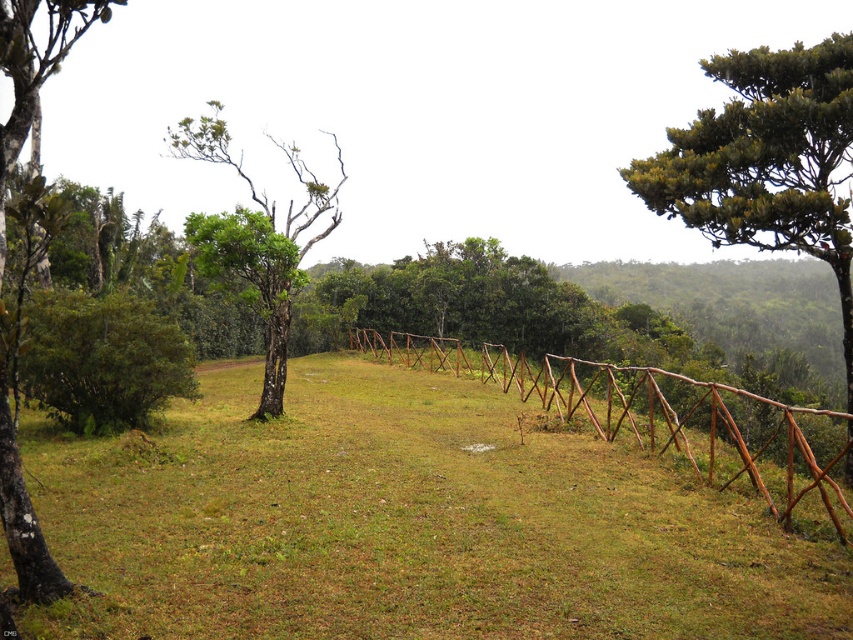
You are standing in the middle of the grassy area and want to walk towards the wooden fence. There are two points marked on the ground, point (836,515) and point (1,348). Which point should you walk towards to get closer to the fence?

You should walk towards point (836,515) because it is closer to the wooden fence, as it is further to the viewer compared to point (1,348).